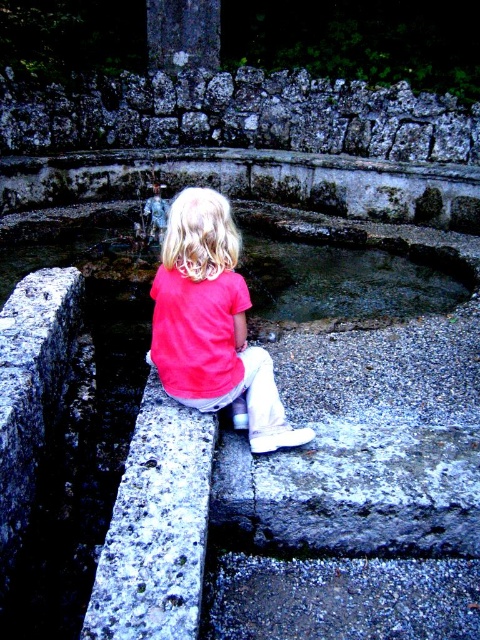
Question: From the image, what is the correct spatial relationship of pink matte shirt at center in relation to smooth stone water at center?

Choices:
 (A) left
 (B) right

Answer: (A)

Question: Which point is closer to the camera taking this photo?

Choices:
 (A) (117, 221)
 (B) (134, 81)
 (C) (239, 317)

Answer: (C)

Question: Does rough stone wall at upper center lie in front of smooth stone water at center?

Choices:
 (A) yes
 (B) no

Answer: (B)

Question: Estimate the real-world distances between objects in this image. Which object is farther from the rough stone wall at upper center?

Choices:
 (A) pink matte shirt at center
 (B) smooth stone water at center

Answer: (A)

Question: Is rough stone wall at upper center smaller than smooth stone water at center?

Choices:
 (A) no
 (B) yes

Answer: (A)

Question: Among these objects, which one is farthest from the camera?

Choices:
 (A) pink matte shirt at center
 (B) rough stone wall at upper center

Answer: (B)